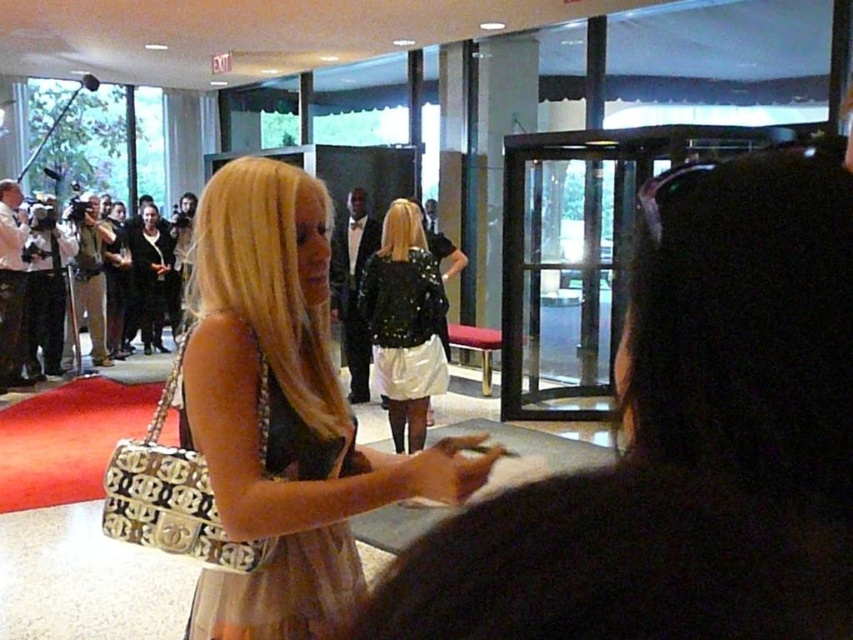
You are a photographer at a fashion event and need to capture both the matte black dress at center and the black satin dress at center in a single shot. Which dress should you focus on first to ensure the one closer to the camera is properly framed?

The matte black dress at center is above the black satin dress at center, so you should focus on the matte black dress at center first as it is closer to the camera.

You are a stylist preparing to dress a client for a formal event. You have two jackets available in your collection. The first is the black sequined jacket at center, and the second is the sequined black jacket at center. The client wants to wear the jacket that is positioned higher up on their body. Which jacket should you choose?

The black sequined jacket at center is above the sequined black jacket at center, so you should choose the black sequined jacket at center as it is positioned higher on the body.